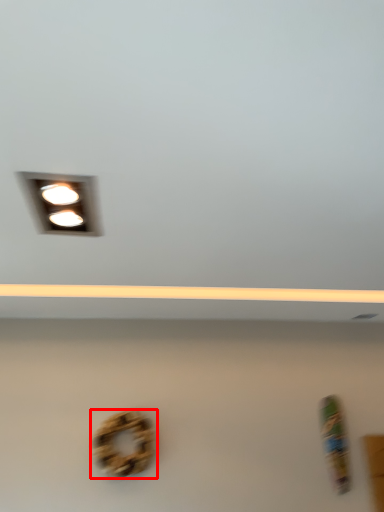
Question: From the image's perspective, where is bagel (annotated by the red box) located relative to lamp?

Choices:
 (A) above
 (B) below

Answer: (B)